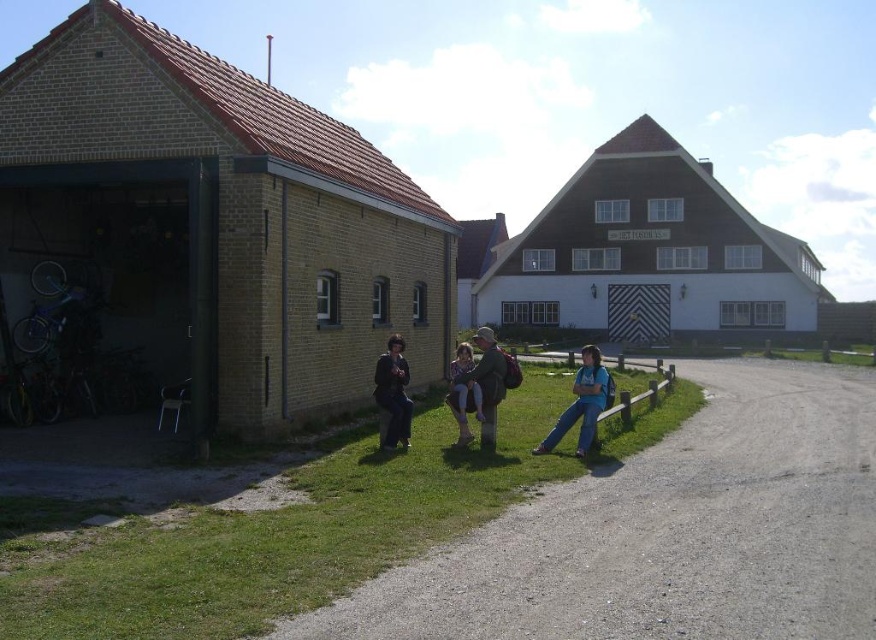
You are organizing a clothing rack and need to arrange the dark brown leather jacket at center and the denim jacket at center vertically. Which jacket should you place on the higher shelf to ensure they are displayed properly?

The dark brown leather jacket at center is taller than the denim jacket at center, so it should be placed on the higher shelf to accommodate its greater height.

You are trying to decide which jacket to take for a hike. Both the matte gray jacket at center and the dark brown leather jacket at center are available. Which jacket has a bigger size?

The matte gray jacket at center has a larger size compared to the dark brown leather jacket at center, so the matte gray jacket at center is bigger in size.

You are organizing a clothing display in a store and have two jackets, the matte gray jacket at center and the dark brown leather jacket at center. If you want to place them side by side with the dark brown leather jacket on the left, where should you position the matte gray jacket?

The matte gray jacket at center is already positioned on the right side of the dark brown leather jacket at center, so to place them side by side with the dark brown leather jacket on the left, you should keep the matte gray jacket at center to the right of the dark brown leather jacket at center.